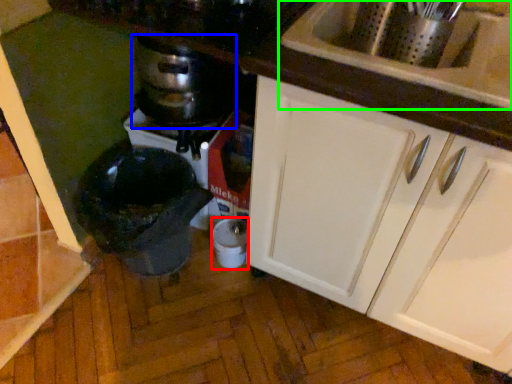
Question: Which object is positioned farthest from appliance (highlighted by a red box)? Select from kitchen appliance (highlighted by a blue box) and sink (highlighted by a green box).

Choices:
 (A) kitchen appliance
 (B) sink

Answer: (B)